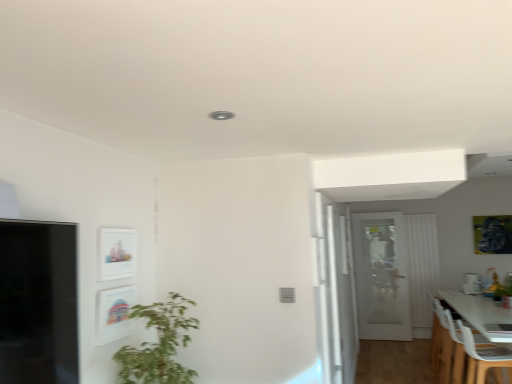
Question: Considering their positions, is white plastic chair at lower right, which is the 1th chair in front-to-back order, located in front of or behind green leafy plant at lower left?

Choices:
 (A) front
 (B) behind

Answer: (B)

Question: From the image's perspective, is white plastic chair at lower right, which is the 1th chair in front-to-back order, positioned above or below green leafy plant at lower left?

Choices:
 (A) below
 (B) above

Answer: (A)

Question: Which is nearer to the green leafy plant at lower right?

Choices:
 (A) green leafy plant at lower left
 (B) matte white picture frame at upper left, which is the second picture frame in front-to-back order
 (C) transparent glass door at center
 (D) metallic gold picture frame at upper right, which appears as the first picture frame when viewed from the right
 (E) white glass door at center

Answer: (D)

Question: Considering the real-world distances, which object is closest to the transparent glass door at center?

Choices:
 (A) metallic gold picture frame at upper right, marked as the first picture frame in a back-to-front arrangement
 (B) green leafy plant at lower right
 (C) white fabric curtain at right
 (D) matte white picture frame at upper left, marked as the third picture frame in a right-to-left arrangement
 (E) white plastic swivel chair at lower right

Answer: (E)